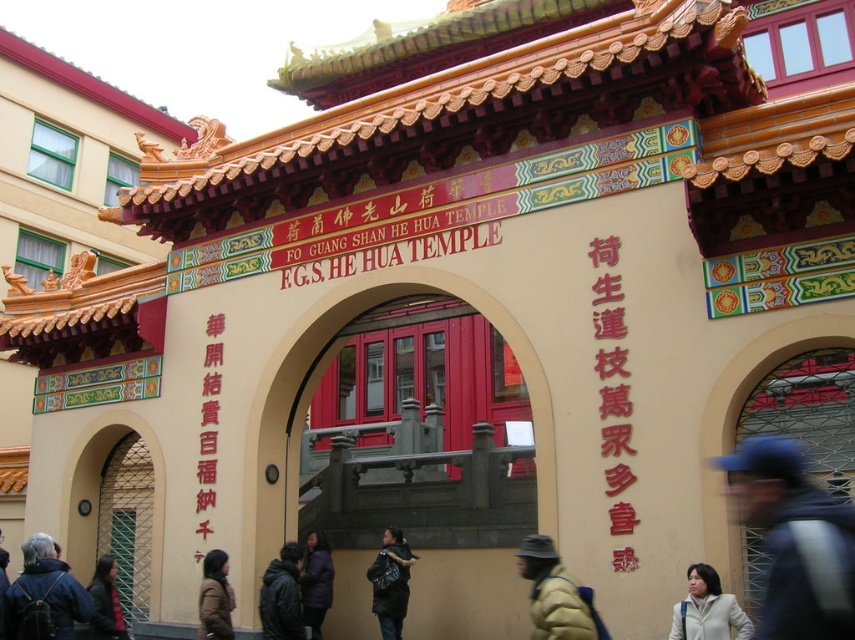
Is point (263, 612) farther from camera compared to point (393, 579)?

No, (263, 612) is in front of (393, 579).

Which is behind, point (264, 632) or point (388, 532)?

Positioned behind is point (388, 532).

Locate an element on the screen. black jacket at lower center is located at coordinates (282, 595).

Consider the image. Which is above, dark gray jacket at center or dark purple jacket at center?

dark purple jacket at center

Is dark gray jacket at center positioned before dark purple jacket at center?

No.

At what (x,y) coordinates should I click in order to perform the action: click on dark gray jacket at center. Please return your answer as a coordinate pair (x, y). This screenshot has width=855, height=640. Looking at the image, I should click on (390, 582).

Find the location of `dark gray jacket at center`. dark gray jacket at center is located at coordinates (390, 582).

Which is more to the left, dark blue jacket at lower left or red paper text at left?

dark blue jacket at lower left

Is dark blue jacket at lower left above red paper text at left?

No, dark blue jacket at lower left is not above red paper text at left.

The height and width of the screenshot is (640, 855). I want to click on dark blue jacket at lower left, so click(43, 595).

Where is `dark blue jacket at lower left`? The image size is (855, 640). dark blue jacket at lower left is located at coordinates (43, 595).